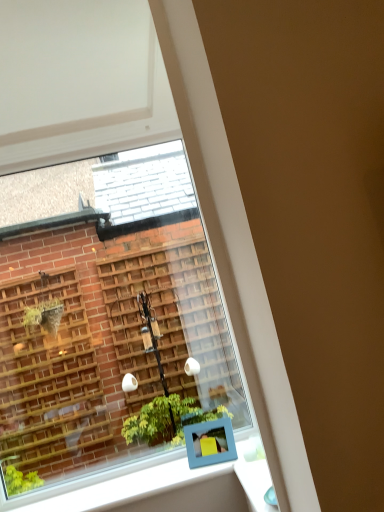
Image resolution: width=384 pixels, height=512 pixels. Describe the element at coordinates (167, 488) in the screenshot. I see `white glossy window sill at lower center` at that location.

Describe the element at coordinates (209, 441) in the screenshot. The height and width of the screenshot is (512, 384). I see `blue plastic frame at lower center` at that location.

Image resolution: width=384 pixels, height=512 pixels. What are the coordinates of `white glossy window sill at lower center` in the screenshot? It's located at click(167, 488).

From their relative heights in the image, would you say clear glass window at upper left is taller or shorter than white glossy window sill at lower center?

Clearly, clear glass window at upper left is taller compared to white glossy window sill at lower center.

Does clear glass window at upper left appear on the left side of white glossy window sill at lower center?

Correct, you'll find clear glass window at upper left to the left of white glossy window sill at lower center.

Is clear glass window at upper left positioned with its back to white glossy window sill at lower center?

clear glass window at upper left is not turned away from white glossy window sill at lower center.

How far apart are blue plastic frame at lower center and clear glass window at upper left?

blue plastic frame at lower center and clear glass window at upper left are 4.70 feet apart from each other.

From the image's perspective, would you say blue plastic frame at lower center is shown under clear glass window at upper left?

Correct, blue plastic frame at lower center appears lower than clear glass window at upper left in the image.

Considering the relative positions of blue plastic frame at lower center and clear glass window at upper left in the image provided, is blue plastic frame at lower center to the left or to the right of clear glass window at upper left?

blue plastic frame at lower center is to the right of clear glass window at upper left.

Does blue plastic frame at lower center have a larger size compared to clear glass window at upper left?

No.

Does white glossy window sill at lower center appear on the right side of clear glass window at upper left?

Correct, you'll find white glossy window sill at lower center to the right of clear glass window at upper left.

Who is more distant, white glossy window sill at lower center or clear glass window at upper left?

clear glass window at upper left is further away from the camera.

From the image's perspective, is white glossy window sill at lower center below clear glass window at upper left?

Yes.

Where is `window sill lying on the right of clear glass window at upper left`? The width and height of the screenshot is (384, 512). window sill lying on the right of clear glass window at upper left is located at coordinates (167, 488).

Does clear glass window at upper left have a smaller size compared to blue plastic frame at lower center?

Incorrect, clear glass window at upper left is not smaller in size than blue plastic frame at lower center.

Considering the positions of points (10, 279) and (191, 445), is point (10, 279) farther from camera compared to point (191, 445)?

Yes.

From a real-world perspective, relative to blue plastic frame at lower center, is clear glass window at upper left vertically above or below?

From a real-world perspective, clear glass window at upper left is physically above blue plastic frame at lower center.

How many degrees apart are the facing directions of clear glass window at upper left and blue plastic frame at lower center?

12.6 degrees separate the facing orientations of clear glass window at upper left and blue plastic frame at lower center.

Is blue plastic frame at lower center smaller than white glossy window sill at lower center?

Indeed, blue plastic frame at lower center has a smaller size compared to white glossy window sill at lower center.

Considering the relative sizes of blue plastic frame at lower center and white glossy window sill at lower center in the image provided, is blue plastic frame at lower center thinner than white glossy window sill at lower center?

Yes, blue plastic frame at lower center is thinner than white glossy window sill at lower center.

From the picture: Does blue plastic frame at lower center lie in front of white glossy window sill at lower center?

That is False.

Is blue plastic frame at lower center shorter than white glossy window sill at lower center?

Incorrect, the height of blue plastic frame at lower center does not fall short of that of white glossy window sill at lower center.

Is white glossy window sill at lower center aimed at blue plastic frame at lower center?

No, white glossy window sill at lower center is not aimed at blue plastic frame at lower center.

Considering the relative positions of white glossy window sill at lower center and blue plastic frame at lower center in the image provided, is white glossy window sill at lower center in front of blue plastic frame at lower center?

Yes, the depth of white glossy window sill at lower center is less than that of blue plastic frame at lower center.

From a real-world perspective, who is located lower, white glossy window sill at lower center or blue plastic frame at lower center?

In real-world perspective, white glossy window sill at lower center is lower.

Who is taller, white glossy window sill at lower center or blue plastic frame at lower center?

With more height is blue plastic frame at lower center.

Identify the location of window sill below the clear glass window at upper left (from a real-world perspective). The image size is (384, 512). (167, 488).

Where is `window box that appears below the clear glass window at upper left (from the image's perspective)`? This screenshot has height=512, width=384. window box that appears below the clear glass window at upper left (from the image's perspective) is located at coordinates (209, 441).

Based on the photo, looking at the image, which one is located further to white glossy window sill at lower center, blue plastic frame at lower center or clear glass window at upper left?

clear glass window at upper left lies further to white glossy window sill at lower center than the other object.

Looking at the image, which one is located closer to blue plastic frame at lower center, clear glass window at upper left or white glossy window sill at lower center?

Based on the image, white glossy window sill at lower center appears to be nearer to blue plastic frame at lower center.

Looking at the image, which one is located further to clear glass window at upper left, blue plastic frame at lower center or white glossy window sill at lower center?

Among the two, blue plastic frame at lower center is located further to clear glass window at upper left.

Which object lies further to the anchor point clear glass window at upper left, white glossy window sill at lower center or blue plastic frame at lower center?

Among the two, blue plastic frame at lower center is located further to clear glass window at upper left.

When comparing their distances from blue plastic frame at lower center, does white glossy window sill at lower center or clear glass window at upper left seem closer?

white glossy window sill at lower center lies closer to blue plastic frame at lower center than the other object.

Considering their positions, is clear glass window at upper left positioned closer to white glossy window sill at lower center than blue plastic frame at lower center?

Based on the image, blue plastic frame at lower center appears to be nearer to white glossy window sill at lower center.

Where is `window box between clear glass window at upper left and white glossy window sill at lower center in the up-down direction`? Image resolution: width=384 pixels, height=512 pixels. window box between clear glass window at upper left and white glossy window sill at lower center in the up-down direction is located at coordinates (209, 441).